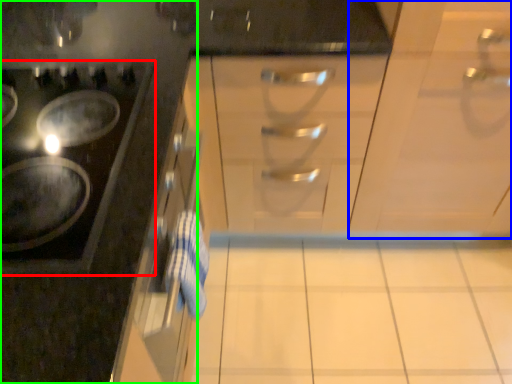
Question: Based on their relative distances, which object is nearer to gas stove (highlighted by a red box)? Choose from cabinetry (highlighted by a blue box) and cabinetry (highlighted by a green box).

Choices:
 (A) cabinetry
 (B) cabinetry

Answer: (B)